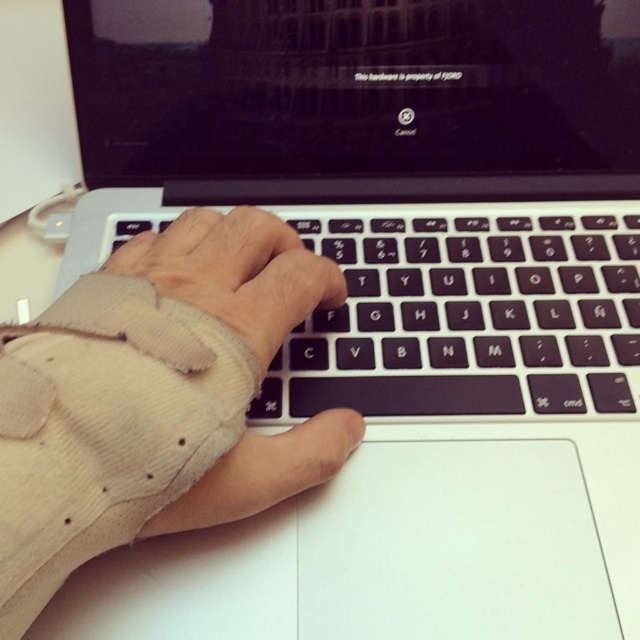
You are designing a new ergonomic desk setup and need to ensure there is enough vertical space between the beige corduroy sleeve at center and the black matte keyboard at center. Based on the image, which object is taller and requires more vertical clearance?

The beige corduroy sleeve at center is taller than the black matte keyboard at center, so it requires more vertical clearance.

You are trying to place a beige corduroy sleeve at center onto the black matte keyboard at center. Based on their widths, can the sleeve fit over the keyboard without overlapping the edges?

The beige corduroy sleeve at center is narrower than the black matte keyboard at center, so it can fit over the keyboard without overlapping the edges.

You need to move a small pen from the beige corduroy sleeve at center to the black matte keyboard at center. How much space do you have to move the pen between them?

The beige corduroy sleeve at center and black matte keyboard at center are 5.43 inches apart, so there is 5.43 inches of space available to move the pen between them.